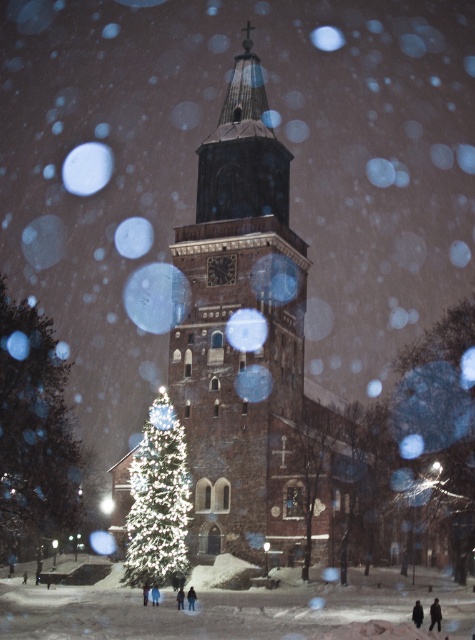
You are standing in a snowy winter night scene and want to take a photo of the brown stone church at center. If your camera can focus on objects up to 60 meters away, will you need to adjust your position to capture the church clearly?

The brown stone church at center is 61.49 meters away, which is beyond the camera focus range of 60 meters. You need to move closer to ensure the church is in focus.